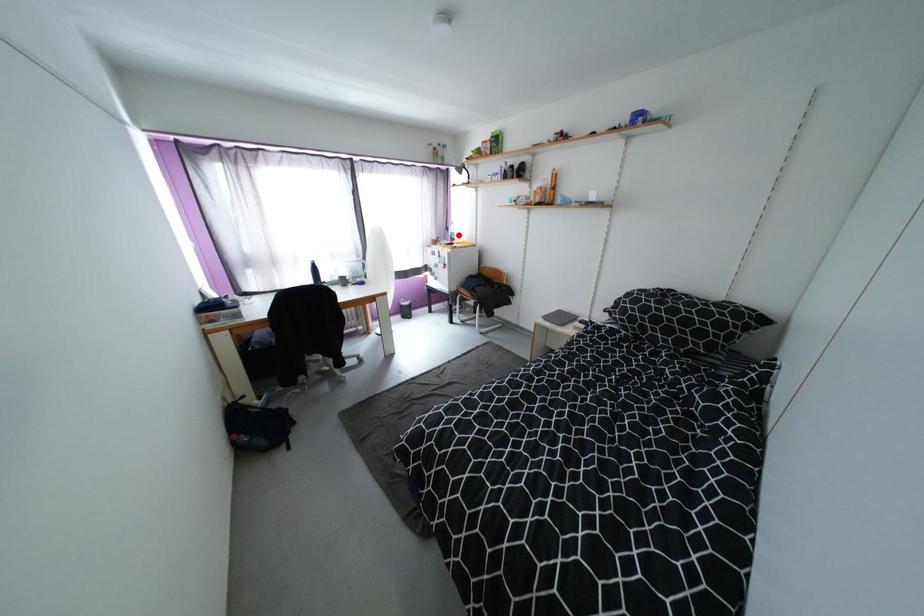
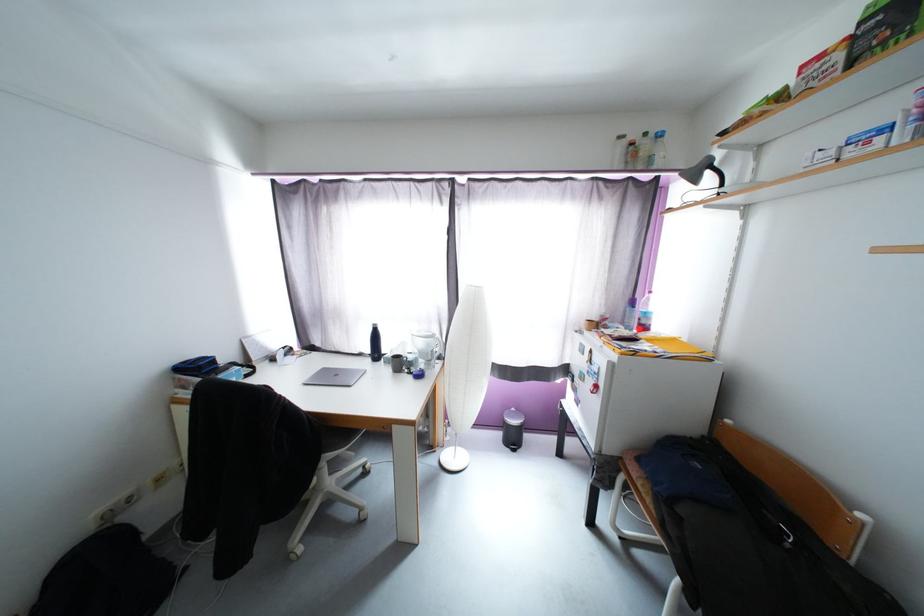
The point at the highlighted location is marked in the first image. Where is the corresponding point in the second image?

(651, 315)